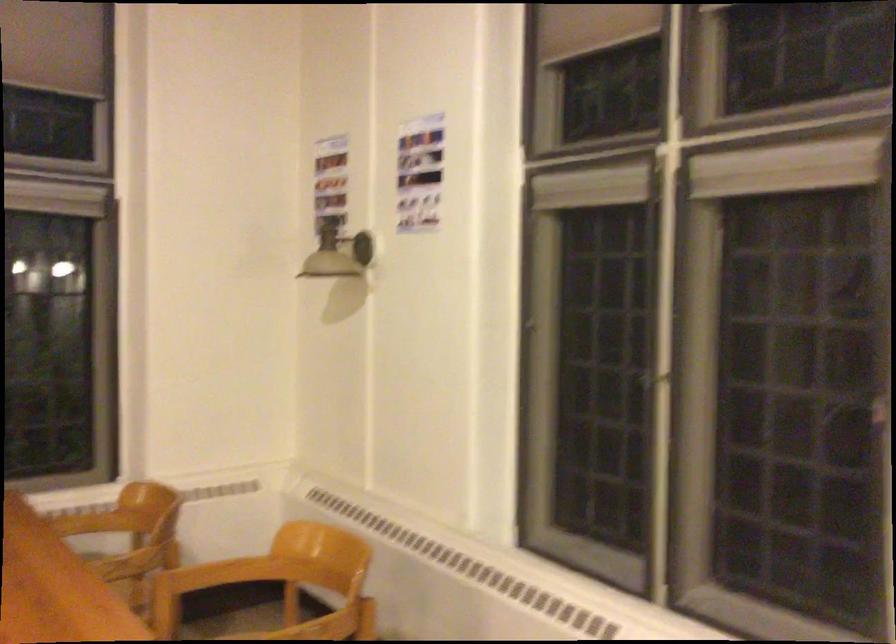
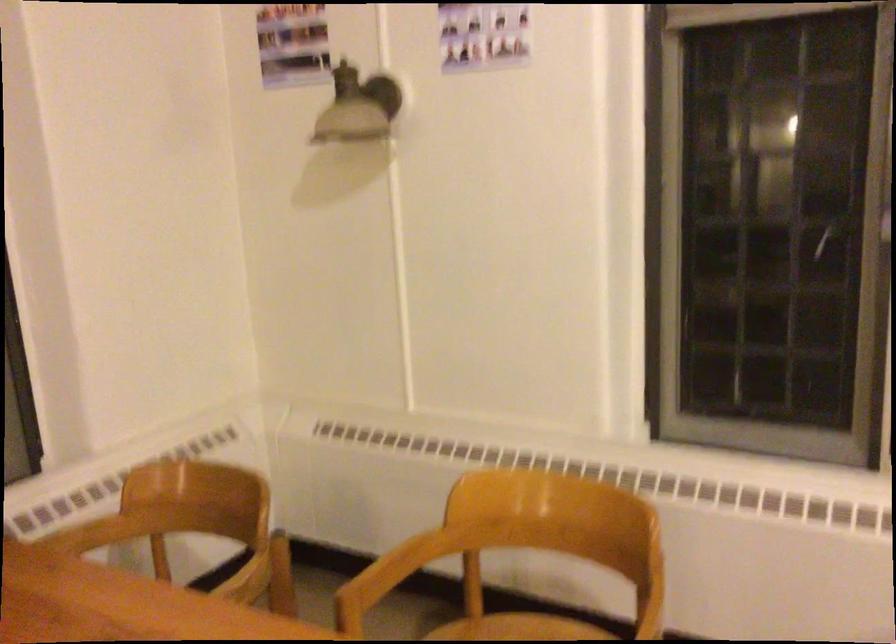
In a continuous first-person perspective shot, in which direction is the camera moving?

The cameraman walked toward left, forward.